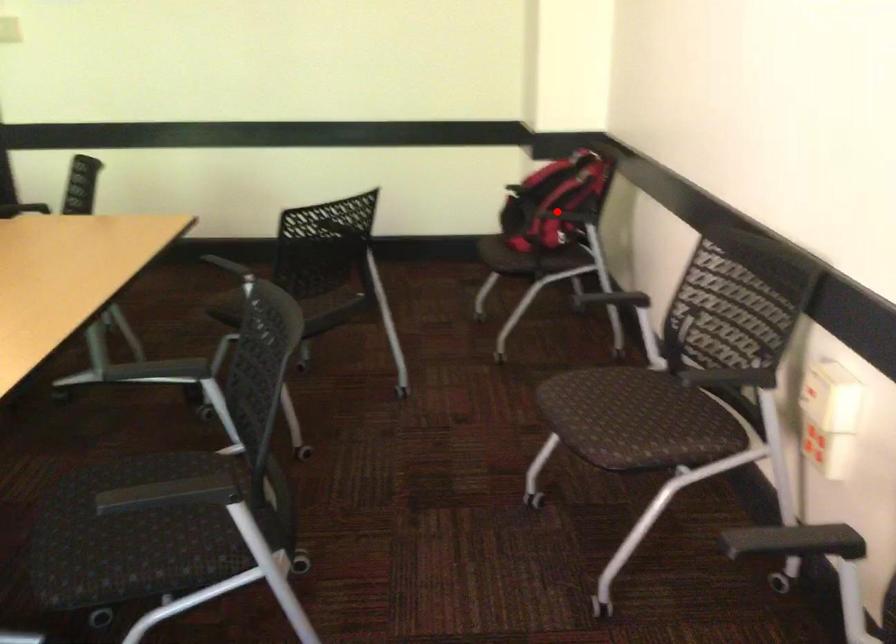
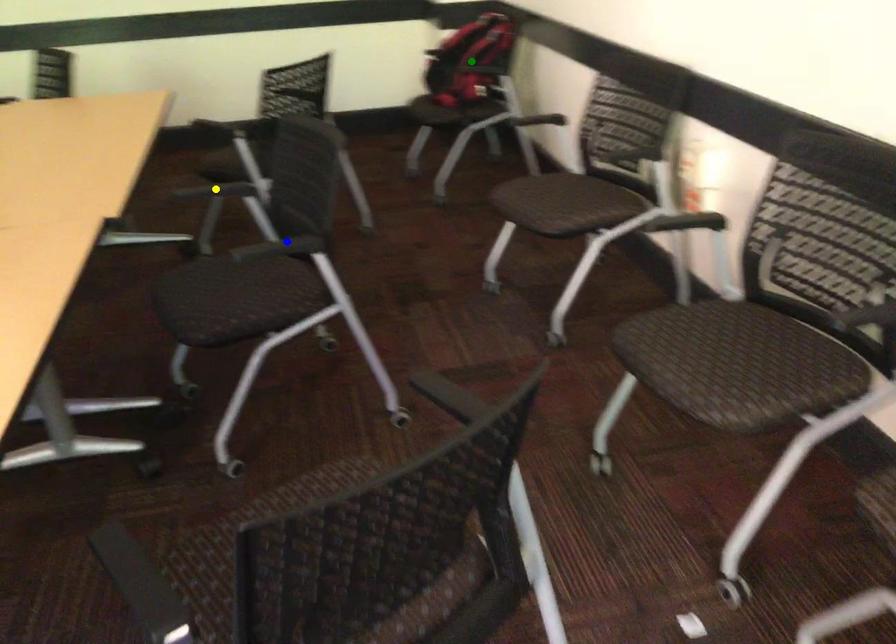
Question: I am providing you with two images of the same scene from different viewpoints. A red point is marked on the first image. You are given multiple points on the second image. Which point in image 2 represents the same 3d spot as the red point in image 1?

Choices:
 (A) green point
 (B) blue point
 (C) yellow point

Answer: (A)